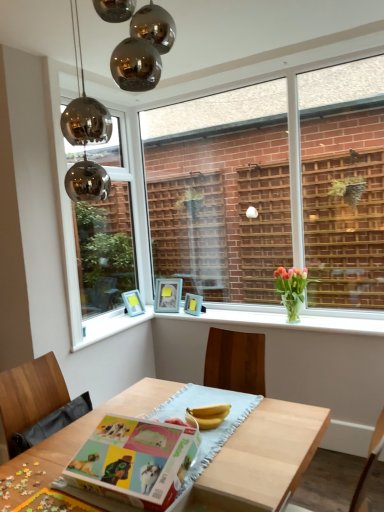
Question: From the image's perspective, is matte blue picture frame at center, the first picture frame when ordered from right to left, beneath matte blue picture frame at upper left, placed as the 3th picture frame when sorted from right to left?

Choices:
 (A) no
 (B) yes

Answer: (B)

Question: Is there a large distance between matte blue picture frame at center, the first picture frame when ordered from right to left, and matte blue picture frame at upper left, placed as the 3th picture frame when sorted from right to left?

Choices:
 (A) no
 (B) yes

Answer: (A)

Question: Can you confirm if matte blue picture frame at center, marked as the third picture frame in a left-to-right arrangement, is wider than matte blue picture frame at upper left, placed as the first picture frame when sorted from left to right?

Choices:
 (A) yes
 (B) no

Answer: (A)

Question: Can you confirm if matte blue picture frame at center, marked as the third picture frame in a left-to-right arrangement, is shorter than matte blue picture frame at upper left, placed as the 3th picture frame when sorted from right to left?

Choices:
 (A) no
 (B) yes

Answer: (B)

Question: From the image's perspective, would you say matte blue picture frame at center, marked as the third picture frame in a left-to-right arrangement, is positioned over matte blue picture frame at upper left, placed as the 3th picture frame when sorted from right to left?

Choices:
 (A) yes
 (B) no

Answer: (B)

Question: Can you confirm if matte blue picture frame at center, marked as the third picture frame in a left-to-right arrangement, is smaller than matte blue picture frame at upper left, placed as the 3th picture frame when sorted from right to left?

Choices:
 (A) no
 (B) yes

Answer: (B)

Question: From the image's perspective, is white glossy window sill at center under matte paperboard book at center?

Choices:
 (A) no
 (B) yes

Answer: (A)

Question: From a real-world perspective, is white glossy window sill at center below matte paperboard book at center?

Choices:
 (A) no
 (B) yes

Answer: (A)

Question: From the image's perspective, does white glossy window sill at center appear higher than matte paperboard book at center?

Choices:
 (A) yes
 (B) no

Answer: (A)

Question: Does white glossy window sill at center have a larger size compared to matte paperboard book at center?

Choices:
 (A) no
 (B) yes

Answer: (A)

Question: Is white glossy window sill at center positioned with its back to matte paperboard book at center?

Choices:
 (A) no
 (B) yes

Answer: (A)

Question: Is white glossy window sill at center to the right of matte paperboard book at center from the viewer's perspective?

Choices:
 (A) no
 (B) yes

Answer: (B)

Question: Is white glossy window sill at center facing towards metallic glass window at upper left, which ranks as the 1th window in left-to-right order?

Choices:
 (A) yes
 (B) no

Answer: (B)